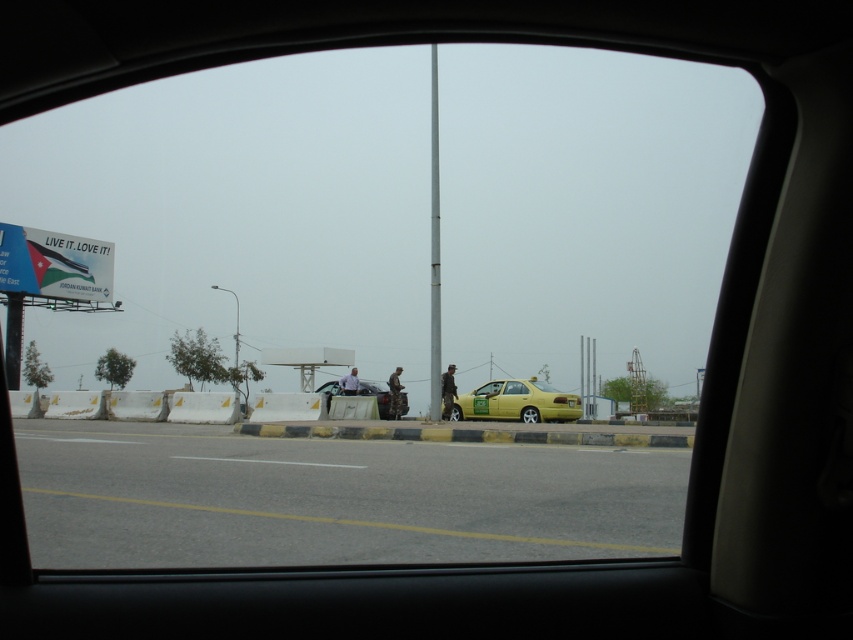
You are a delivery person needing to place a package between the camouflage fabric jacket at center and the light blue shirt at center. Can the package, which is 1.5 meters long, fit in the space between them?

The camouflage fabric jacket at center and light blue shirt at center are 1.36 meters apart from each other. The package is 1.5 meters long, which is longer than the available space. Therefore, the package cannot fit between them.

You are a driver looking through the rear window of your car. You notice two points marked on the road ahead. The first point is at coordinates point (578, 413) and the second is at point (398, 394). Which point is closer to your car?

Point (398, 394) is closer to your car because in the scene, point (578, 413) is behind point (398, 394).

You are a passenger in the vehicle and looking out the rear window. You notice two people in the scene wearing a camouflage fabric jacket at center and a light blue shirt at center. Which clothing item is bigger in size?

The camouflage fabric jacket at center is larger in size compared to the light blue shirt at center.